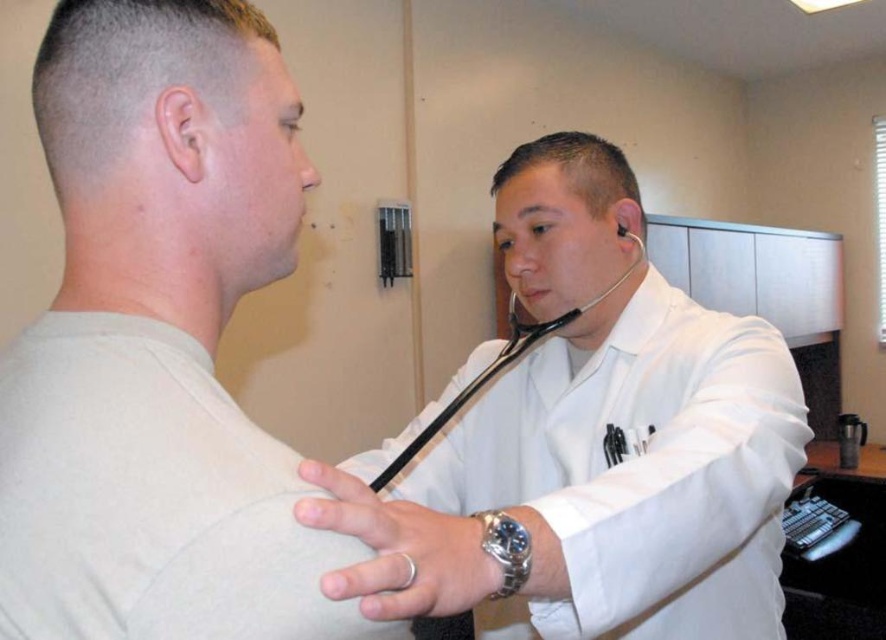
Does pale skin at center appear over black rubber stethoscope at upper center?

Yes, pale skin at center is above black rubber stethoscope at upper center.

This screenshot has height=640, width=886. I want to click on pale skin at center, so click(149, 260).

This screenshot has height=640, width=886. In order to click on pale skin at center in this screenshot , I will do `click(149, 260)`.

Where is `pale skin at center`? pale skin at center is located at coordinates (149, 260).

Is white smooth stethoscope at upper right above black rubber stethoscope at upper center?

No, white smooth stethoscope at upper right is not above black rubber stethoscope at upper center.

Does white smooth stethoscope at upper right have a larger size compared to black rubber stethoscope at upper center?

Indeed, white smooth stethoscope at upper right has a larger size compared to black rubber stethoscope at upper center.

Identify the location of white smooth stethoscope at upper right. Image resolution: width=886 pixels, height=640 pixels. (593, 483).

Can you confirm if white smooth stethoscope at upper right is thinner than pale skin at center?

No, white smooth stethoscope at upper right is not thinner than pale skin at center.

Does white smooth stethoscope at upper right appear over pale skin at center?

Actually, white smooth stethoscope at upper right is below pale skin at center.

Where is `white smooth stethoscope at upper right`? The height and width of the screenshot is (640, 886). white smooth stethoscope at upper right is located at coordinates (593, 483).